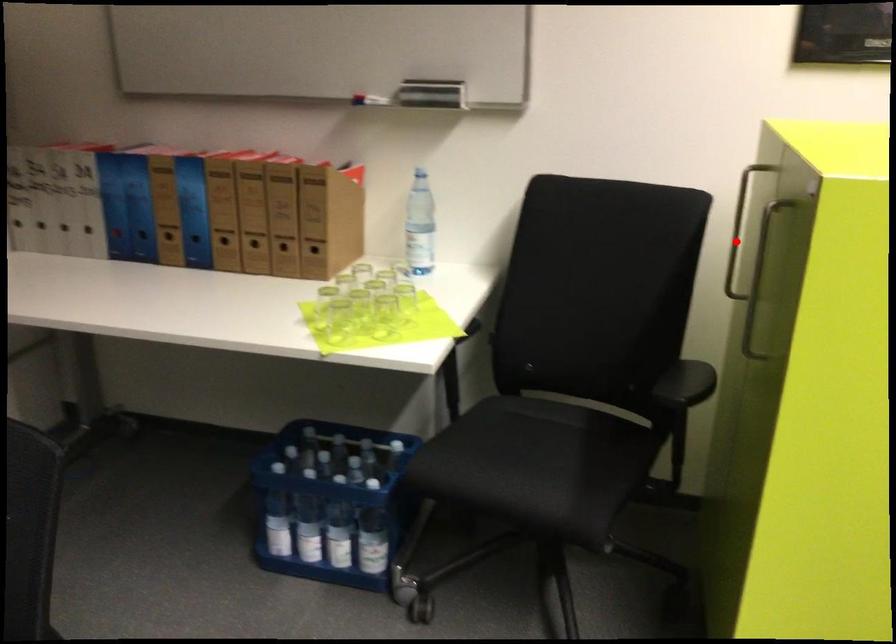
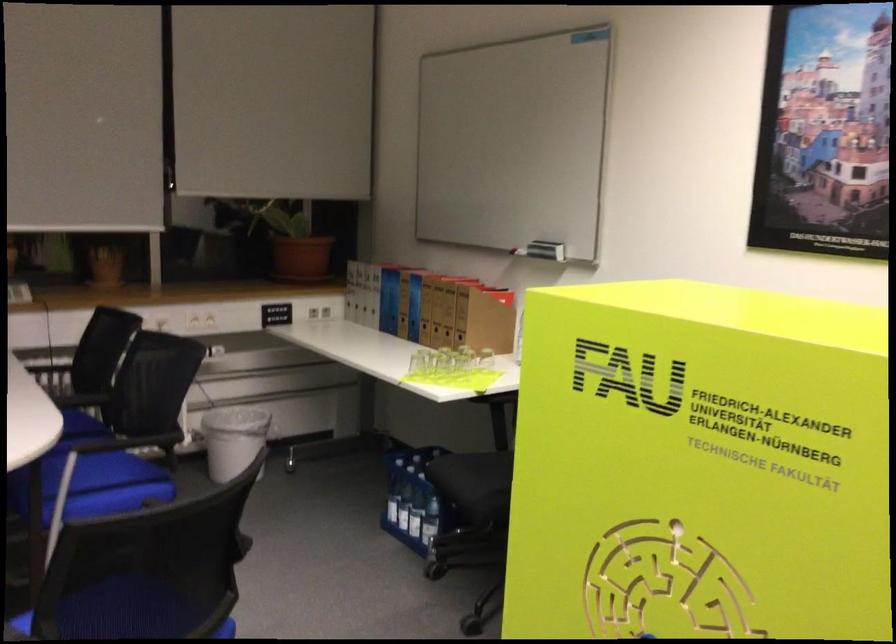
Question: I am providing you with two images of the same scene from different viewpoints. A red point is marked on the first image. At the location where the point appears in image 1, is it still visible in image 2?

Choices:
 (A) Yes
 (B) No

Answer: (B)